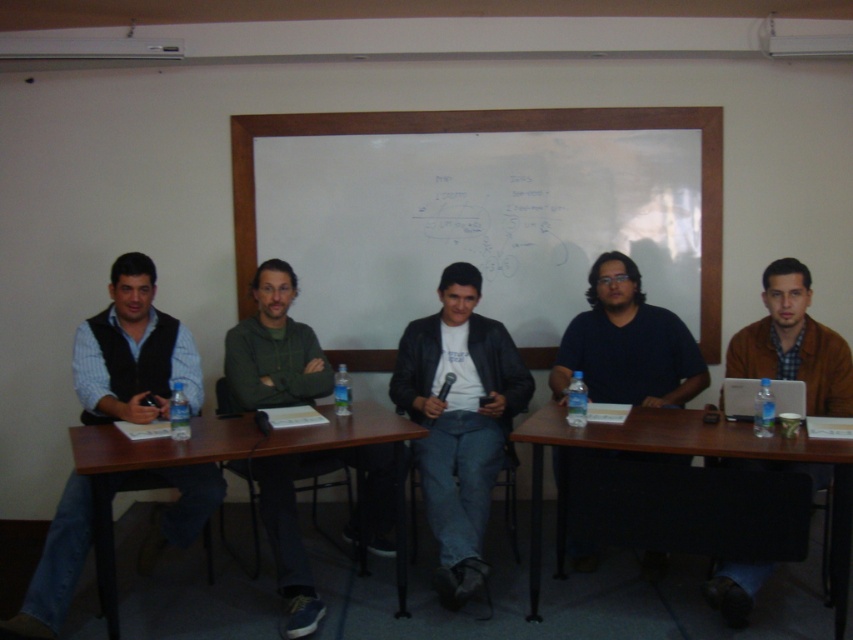
You are sitting at the long wooden table in the classroom. You notice two points marked on the table. The first point is at position point (817, 474) and the second point is at point (444, 182). If you want to move an object from the first point to the second point, which direction should you move it?

The point (817, 474) is in front of point (444, 182), so you should move the object backward towards the second point.

You are sitting at the long wooden table in the classroom and need to pass a document to someone sitting at point [445,541]. If you are currently at point [816,470], which direction should you move to reach them?

Since point [445,541] is behind point [816,470], you should move forward to reach them.